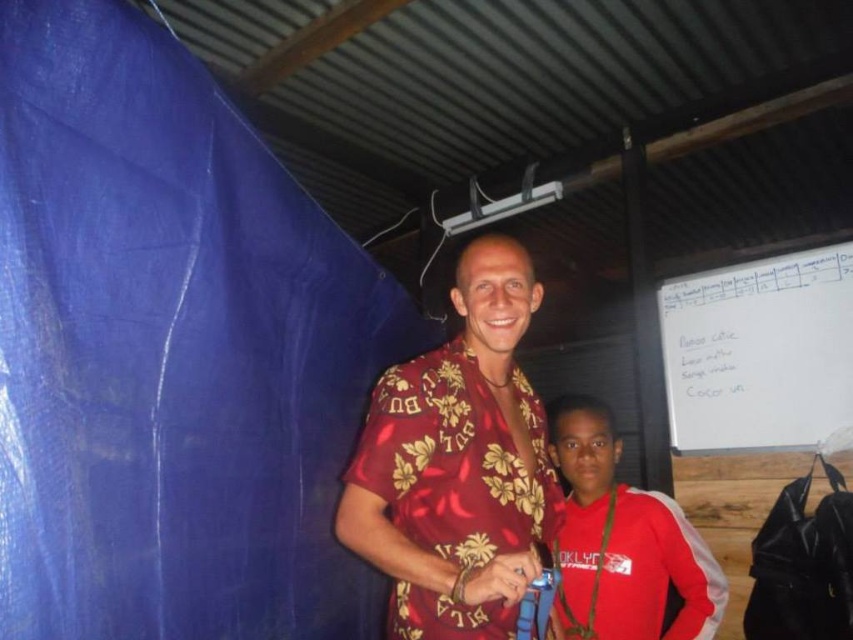
In the scene shown: Can you confirm if shiny silk shirt at center is bigger than red satin jacket at lower right?

Yes.

Does shiny silk shirt at center have a lesser width compared to red satin jacket at lower right?

Indeed, shiny silk shirt at center has a lesser width compared to red satin jacket at lower right.

You are a GUI agent. You are given a task and a screenshot of the screen. Output one action in this format:
    pyautogui.click(x=<x>, y=<y>)
    Task: Click on the shiny silk shirt at center
    
    Given the screenshot: What is the action you would take?
    pyautogui.click(x=457, y=465)